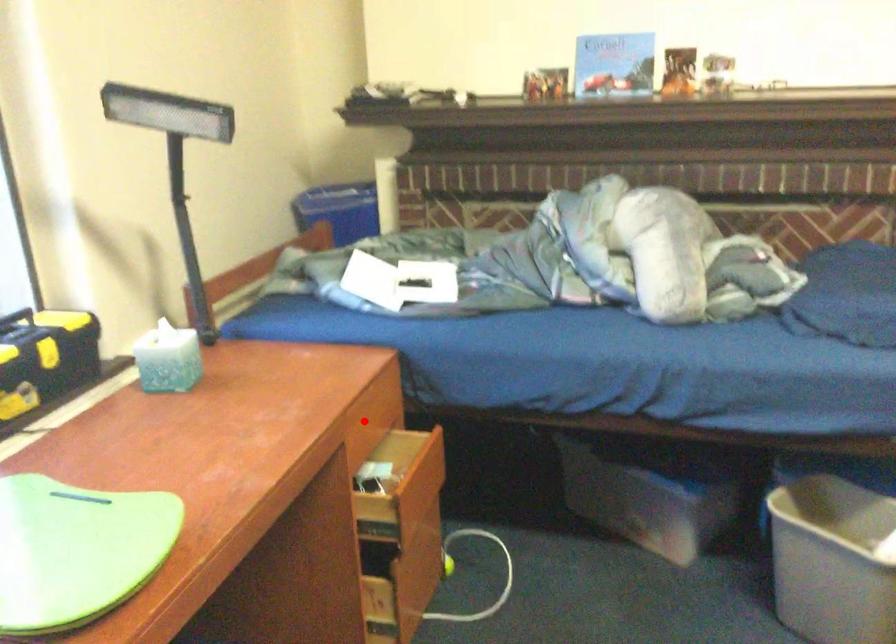
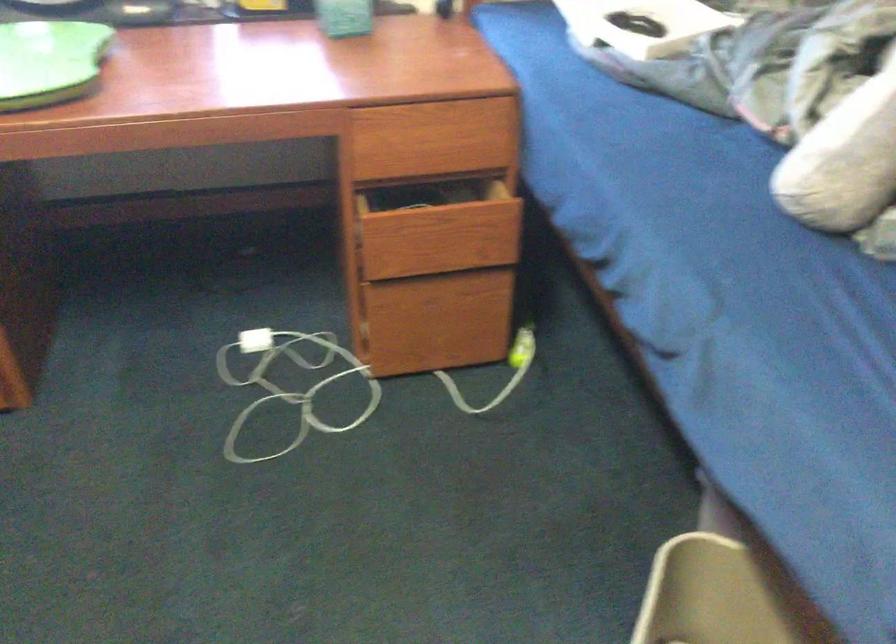
Question: I am providing you with two images of the same scene from different viewpoints. Image1 has a red point marked. In image2, the corresponding 3D location appears at what relative position? Reply with the corresponding letter.

Choices:
 (A) Closer
 (B) Farther

Answer: (A)